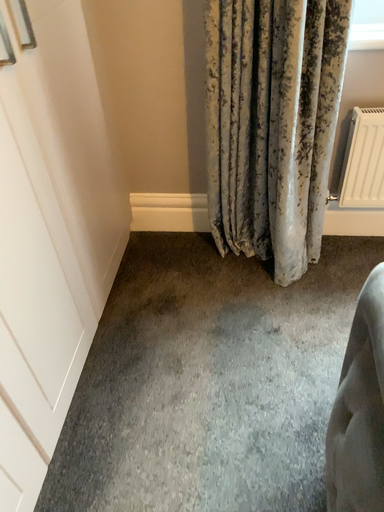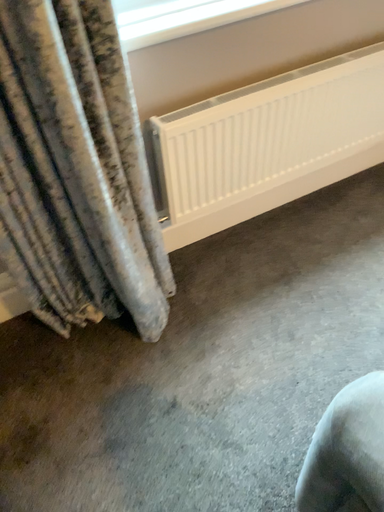
Question: How did the camera likely rotate when shooting the video?

Choices:
 (A) rotated right
 (B) rotated left

Answer: (A)